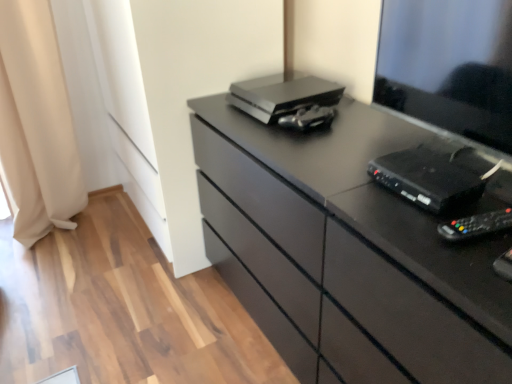
At what (x,y) coordinates should I click in order to perform the action: click on vacant space that is to the left of black plastic device at right, which ranks as the 2th equipment in front-to-back order. Please return your answer as a coordinate pair (x, y). Looking at the image, I should click on (349, 187).